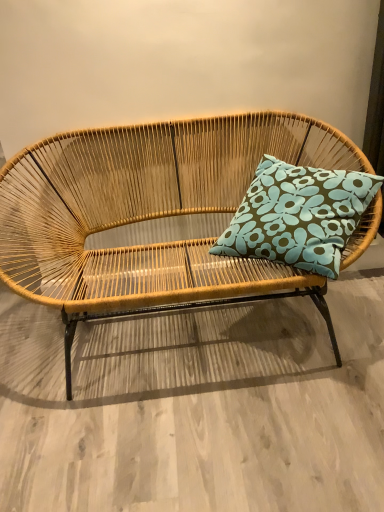
Describe the element at coordinates (298, 215) in the screenshot. I see `teal floral cushion at center` at that location.

Locate an element on the screen. The width and height of the screenshot is (384, 512). teal floral cushion at center is located at coordinates (298, 215).

Describe the element at coordinates (152, 215) in the screenshot. I see `natural woven studio couch at center` at that location.

Where is `natural woven studio couch at center`? natural woven studio couch at center is located at coordinates (152, 215).

This screenshot has width=384, height=512. Find the location of `teal floral cushion at center`. teal floral cushion at center is located at coordinates (298, 215).

Considering the relative positions of teal floral cushion at center and natural woven studio couch at center in the image provided, is teal floral cushion at center to the right of natural woven studio couch at center from the viewer's perspective?

Yes.

In the scene shown: Considering the positions of objects teal floral cushion at center and natural woven studio couch at center in the image provided, who is behind, teal floral cushion at center or natural woven studio couch at center?

teal floral cushion at center is further away from the camera.

Considering the positions of point (279, 239) and point (112, 155), is point (279, 239) closer or farther from the camera than point (112, 155)?

Point (279, 239) is closer to the camera than point (112, 155).

From the image's perspective, which is above, teal floral cushion at center or natural woven studio couch at center?

teal floral cushion at center, from the image's perspective.

From a real-world perspective, which object rests below the other?

natural woven studio couch at center.

Considering the relative sizes of teal floral cushion at center and natural woven studio couch at center in the image provided, is teal floral cushion at center thinner than natural woven studio couch at center?

Yes, teal floral cushion at center is thinner than natural woven studio couch at center.

Between teal floral cushion at center and natural woven studio couch at center, which one has more height?

natural woven studio couch at center is taller.

Considering the sizes of objects teal floral cushion at center and natural woven studio couch at center in the image provided, who is bigger, teal floral cushion at center or natural woven studio couch at center?

Bigger between the two is natural woven studio couch at center.

Is teal floral cushion at center positioned beyond the bounds of natural woven studio couch at center?

Actually, teal floral cushion at center is at least partially inside natural woven studio couch at center.

From the picture: Does teal floral cushion at center touch natural woven studio couch at center?

teal floral cushion at center and natural woven studio couch at center are clearly separated.

Could you tell me if teal floral cushion at center is turned towards natural woven studio couch at center?

Yes, teal floral cushion at center is aimed at natural woven studio couch at center.

How distant is teal floral cushion at center from natural woven studio couch at center?

A distance of 9.76 inches exists between teal floral cushion at center and natural woven studio couch at center.

This screenshot has height=512, width=384. In order to click on studio couch lying on the left of teal floral cushion at center in this screenshot , I will do `click(152, 215)`.

Between natural woven studio couch at center and teal floral cushion at center, which one appears on the right side from the viewer's perspective?

teal floral cushion at center is more to the right.

Who is more distant, natural woven studio couch at center or teal floral cushion at center?

teal floral cushion at center is more distant.

Does point (105, 193) appear closer or farther from the camera than point (371, 188)?

Point (105, 193) appears to be farther away from the viewer than point (371, 188).

From the image's perspective, is natural woven studio couch at center above or below teal floral cushion at center?

natural woven studio couch at center is situated lower than teal floral cushion at center in the image.

From a real-world perspective, who is located higher, natural woven studio couch at center or teal floral cushion at center?

teal floral cushion at center, from a real-world perspective.

Considering the sizes of objects natural woven studio couch at center and teal floral cushion at center in the image provided, who is wider, natural woven studio couch at center or teal floral cushion at center?

With larger width is natural woven studio couch at center.

In terms of height, does natural woven studio couch at center look taller or shorter compared to teal floral cushion at center?

Considering their sizes, natural woven studio couch at center has more height than teal floral cushion at center.

Can you confirm if natural woven studio couch at center is smaller than teal floral cushion at center?

No, natural woven studio couch at center is not smaller than teal floral cushion at center.

Which is correct: natural woven studio couch at center is inside teal floral cushion at center, or outside of it?

natural woven studio couch at center is outside teal floral cushion at center.

Can you see natural woven studio couch at center touching teal floral cushion at center?

No, natural woven studio couch at center is not touching teal floral cushion at center.

Could you tell me if natural woven studio couch at center is turned towards teal floral cushion at center?

Yes.

Locate an element on the screen. The image size is (384, 512). pillow that is on the right side of natural woven studio couch at center is located at coordinates (298, 215).

Image resolution: width=384 pixels, height=512 pixels. I want to click on studio couch that is below the teal floral cushion at center (from the image's perspective), so click(152, 215).

You are a GUI agent. You are given a task and a screenshot of the screen. Output one action in this format:
    pyautogui.click(x=<x>, y=<y>)
    Task: Click on the studio couch lying in front of the teal floral cushion at center
    This screenshot has width=384, height=512.
    Given the screenshot: What is the action you would take?
    pyautogui.click(x=152, y=215)